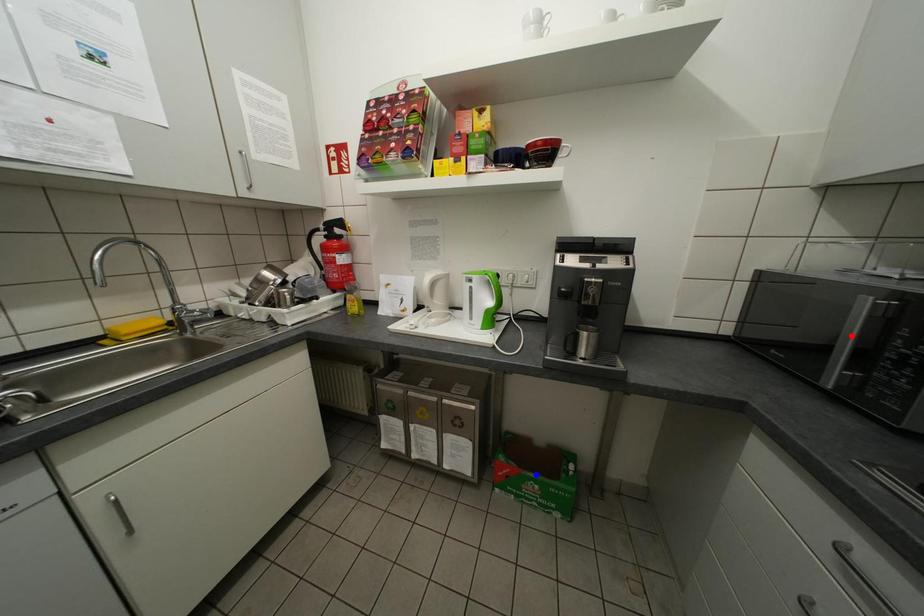
Question: In the image, two points are highlighted. Which point is nearer to the camera? Reply with the corresponding letter.

Choices:
 (A) blue point
 (B) red point

Answer: (B)